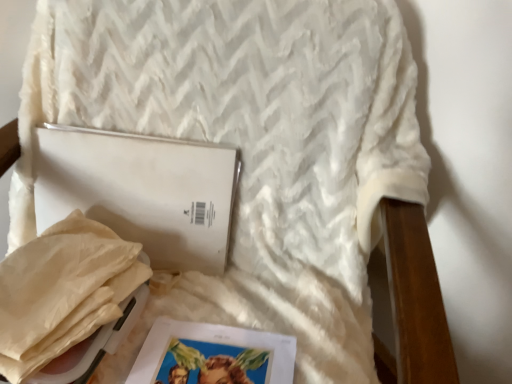
Question: Does beige paper bag at lower left turn towards matte paper magazine at lower center?

Choices:
 (A) no
 (B) yes

Answer: (A)

Question: Considering the relative sizes of beige paper bag at lower left and matte paper magazine at lower center in the image provided, is beige paper bag at lower left shorter than matte paper magazine at lower center?

Choices:
 (A) yes
 (B) no

Answer: (B)

Question: Is beige paper bag at lower left far away from matte paper magazine at lower center?

Choices:
 (A) yes
 (B) no

Answer: (B)

Question: Could matte paper magazine at lower center be considered to be inside beige paper bag at lower left?

Choices:
 (A) no
 (B) yes

Answer: (A)

Question: Is beige paper bag at lower left at the left side of matte paper magazine at lower center?

Choices:
 (A) no
 (B) yes

Answer: (B)

Question: Does beige paper bag at lower left lie behind matte paper magazine at lower center?

Choices:
 (A) no
 (B) yes

Answer: (B)

Question: Is matte paper magazine at lower center not inside white matte journal at center?

Choices:
 (A) no
 (B) yes

Answer: (B)

Question: Is matte paper magazine at lower center touching white matte journal at center?

Choices:
 (A) yes
 (B) no

Answer: (B)

Question: From the image's perspective, is matte paper magazine at lower center beneath white matte journal at center?

Choices:
 (A) yes
 (B) no

Answer: (A)

Question: Considering the relative sizes of matte paper magazine at lower center and white matte journal at center in the image provided, is matte paper magazine at lower center taller than white matte journal at center?

Choices:
 (A) no
 (B) yes

Answer: (A)

Question: Does matte paper magazine at lower center come behind white matte journal at center?

Choices:
 (A) yes
 (B) no

Answer: (B)

Question: Would you say matte paper magazine at lower center is a long distance from white matte journal at center?

Choices:
 (A) no
 (B) yes

Answer: (A)

Question: Is beige paper bag at lower left outside white matte journal at center?

Choices:
 (A) yes
 (B) no

Answer: (A)